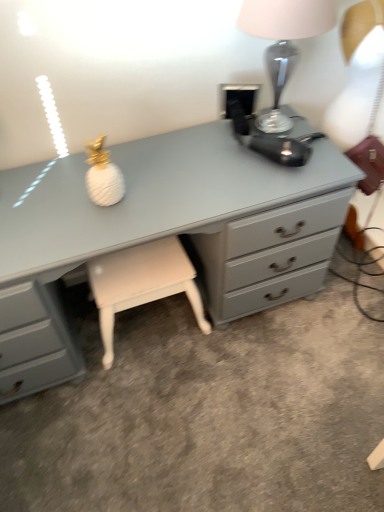
Find the location of `blank space situated above white leather stool at center (from a real-world perspective)`. blank space situated above white leather stool at center (from a real-world perspective) is located at coordinates (131, 268).